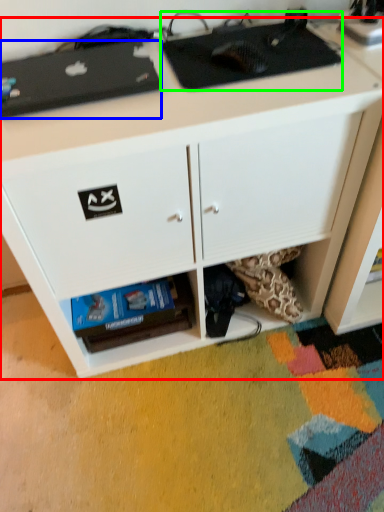
Question: Estimate the real-world distances between objects in this image. Which object is farther from desk (highlighted by a red box), appliance (highlighted by a blue box) or appliance (highlighted by a green box)?

Choices:
 (A) appliance
 (B) appliance

Answer: (A)